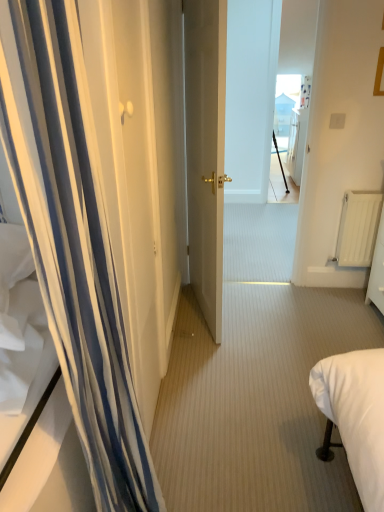
Question: Looking at their shapes, would you say white matte radiator at right is wider or thinner than matte gold door at center?

Choices:
 (A) thin
 (B) wide

Answer: (A)

Question: From a real-world perspective, is white matte radiator at right above or below matte gold door at center?

Choices:
 (A) below
 (B) above

Answer: (A)

Question: Estimate the real-world distances between objects in this image. Which object is farther from the white striped curtain at left?

Choices:
 (A) white matte radiator at right
 (B) matte gold door at center
 (C) black matte tripod at center

Answer: (C)

Question: Based on their relative distances, which object is nearer to the white matte radiator at right?

Choices:
 (A) black matte tripod at center
 (B) matte gold door at center
 (C) white striped curtain at left

Answer: (B)